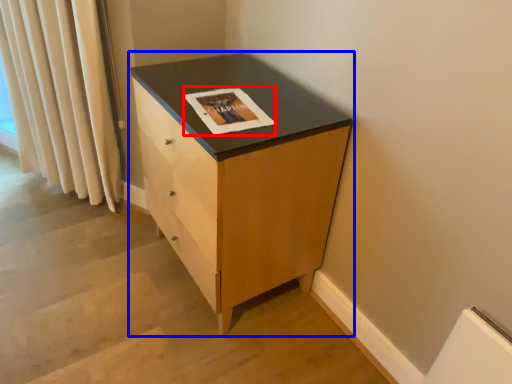
Question: Which object is further to the camera taking this photo, magazine (highlighted by a red box) or chest of drawers (highlighted by a blue box)?

Choices:
 (A) magazine
 (B) chest of drawers

Answer: (A)